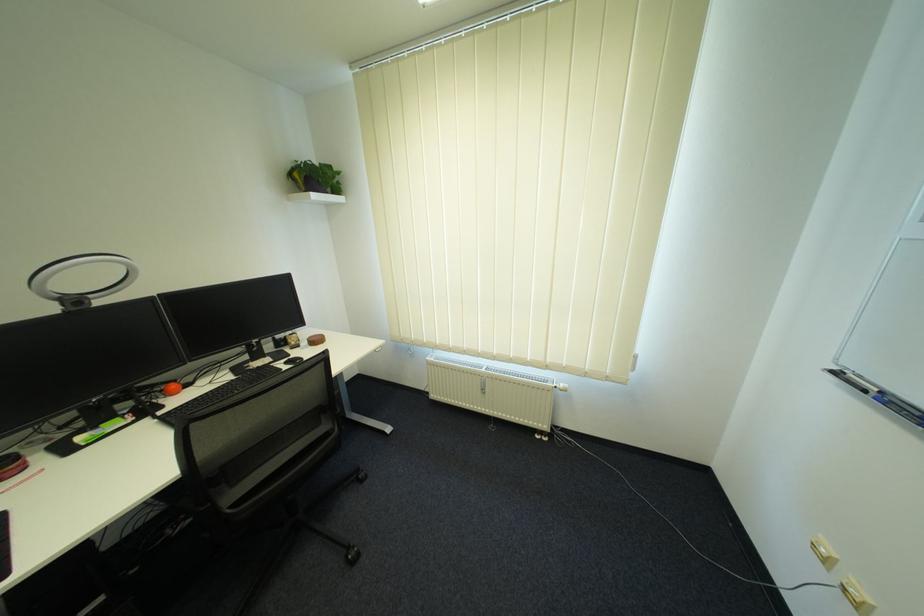
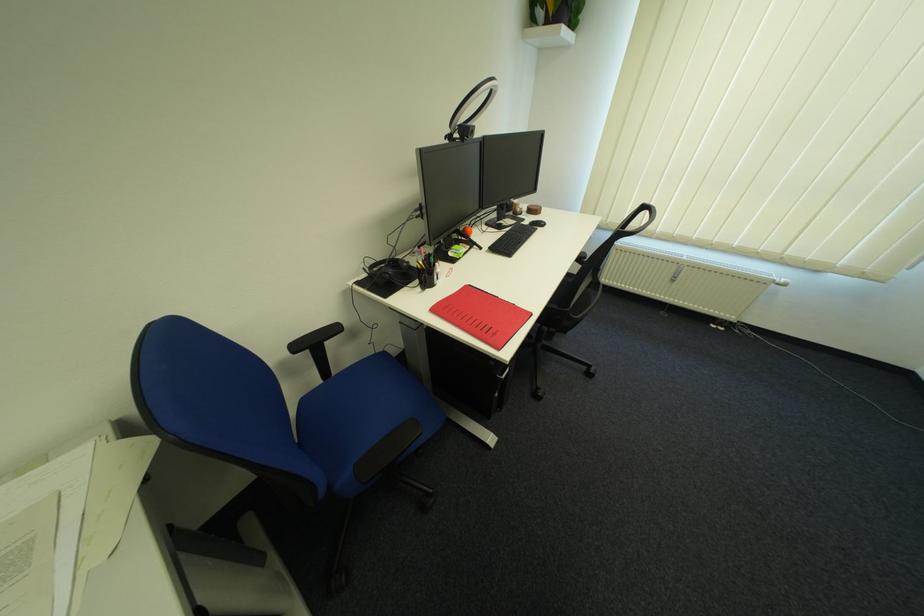
Locate, in the second image, the point that corresponds to [143,419] in the first image.

(479, 248)